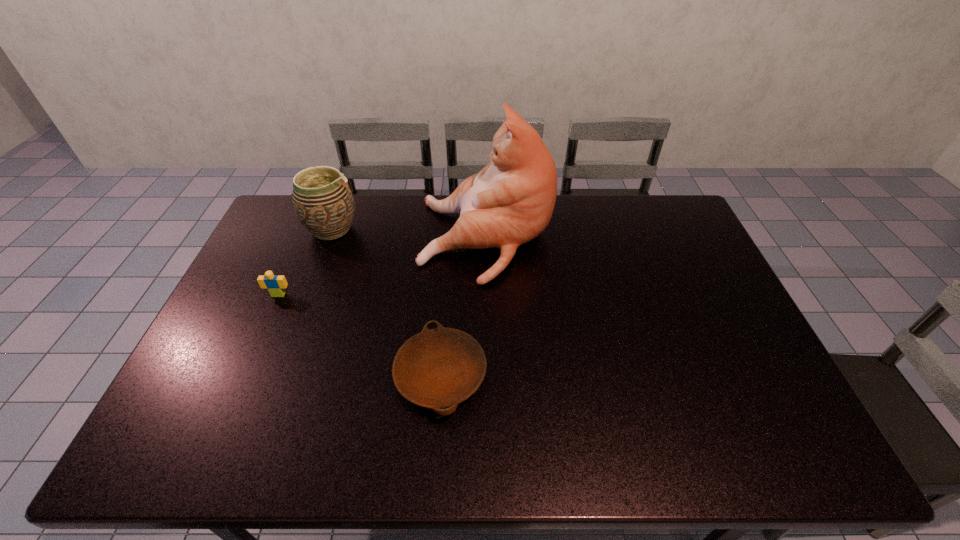
Identify the location of vacant region located 0.230m on the face of the Lego. This screenshot has width=960, height=540. click(x=250, y=361).

Image resolution: width=960 pixels, height=540 pixels. Identify the location of free space located 0.280m on the right of the nearest object. (594, 375).

Where is `cat that is at the far edge`? cat that is at the far edge is located at coordinates (510, 201).

The width and height of the screenshot is (960, 540). I want to click on pottery that is at the far edge, so click(323, 202).

Identify the location of pottery at the left edge. The height and width of the screenshot is (540, 960). (323, 202).

At what (x,y) coordinates should I click in order to perform the action: click on Lego positioned at the left edge. Please return your answer as a coordinate pair (x, y). This screenshot has height=540, width=960. Looking at the image, I should click on (275, 283).

In order to click on object that is at the far left corner in this screenshot , I will do `click(323, 202)`.

Identify the location of vacant area at the far edge. (390, 197).

You are a GUI agent. You are given a task and a screenshot of the screen. Output one action in this format:
    pyautogui.click(x=<x>, y=<y>)
    Task: Click on the free space at the near edge of the desktop
    Image resolution: width=960 pixels, height=540 pixels.
    Given the screenshot: What is the action you would take?
    pyautogui.click(x=561, y=438)

Locate an element on the screen. This screenshot has width=960, height=540. free region at the left edge of the desktop is located at coordinates (300, 237).